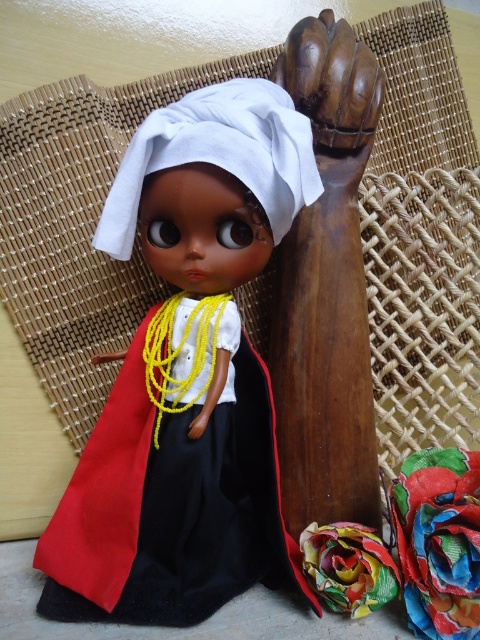
You are a tailor measuring the width of items in the image. You have a 20 cm wide tailor tape. Which item, the matte black dress at center or the multicolored fabric at lower right, will require you to extend your tape beyond 20 cm?

The matte black dress at center has a larger width than the multicolored fabric at lower right, so the matte black dress at center will require the tailor to extend the tape beyond 20 cm if its width exceeds the tape length.

You are a photographer trying to capture the doll in the image. You notice the matte black dress at center and the white cotton cloth at center. Which object is closer to your camera lens?

The matte black dress at center is closer to the camera lens than the white cotton cloth at center.